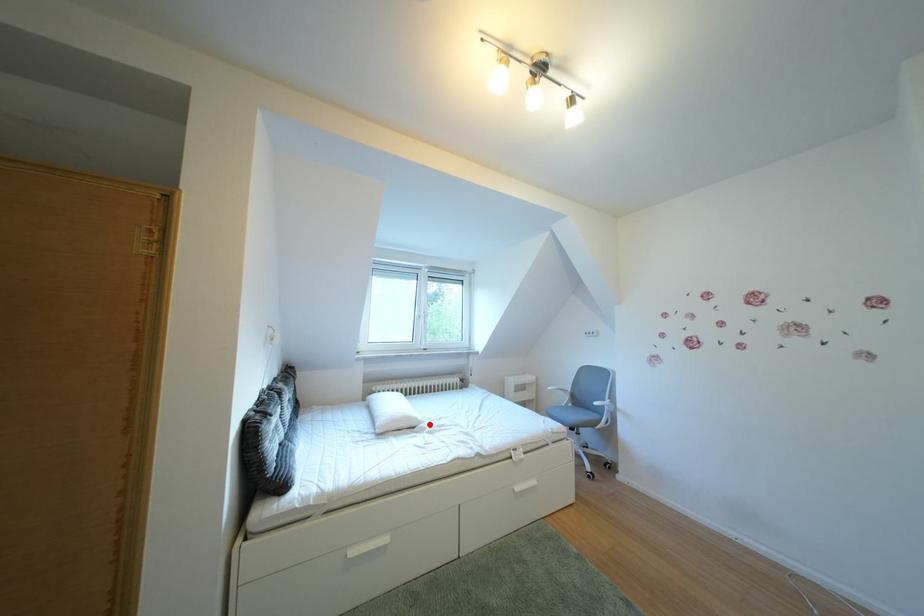
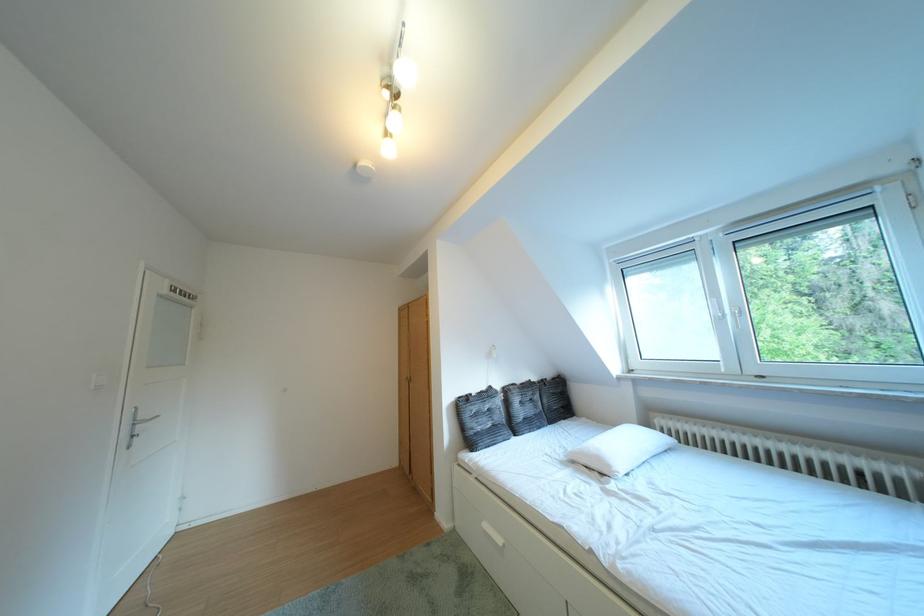
Where in the second image is the point corresponding to the highlighted location from the first image?

(623, 471)